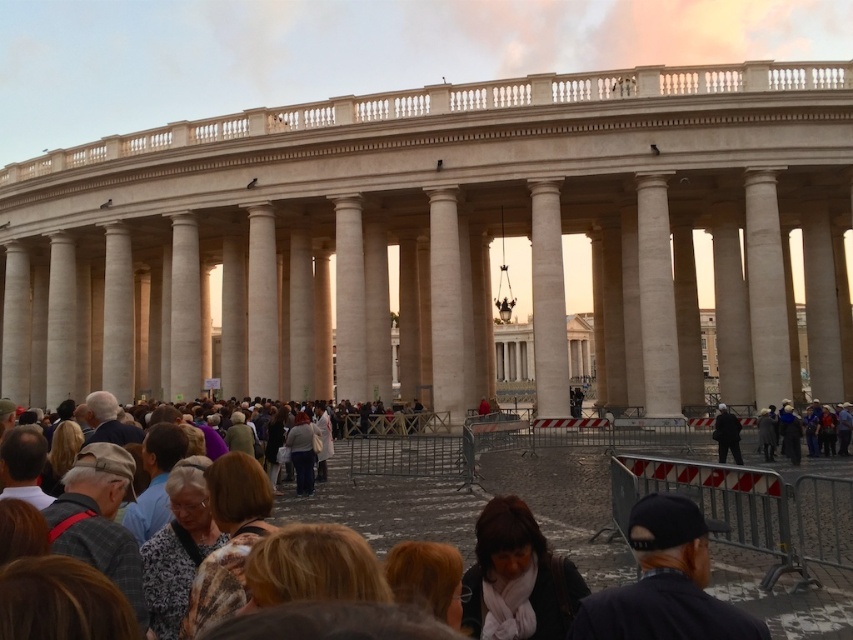
From the picture: You are standing in front of the grand classical building and want to take a photo of the white marble column at center and the light brown leather jacket at center. If your camera has a maximum focusing distance of 85 feet, will you be able to capture both objects clearly in the same photo?

The white marble column at center is 87.80 feet away from the light brown leather jacket at center. Since the camera can only focus up to 85 feet, the distance between them exceeds the camera range. Therefore, you cannot capture both objects clearly in the same photo.

You are standing in the crowd in front of the grand classical building. You notice two points marked in the scene. The first point is at coordinates point (491, 509), and the second is at point (308, 445). Which point is closer to you?

Point (491, 509) is in front of point (308, 445), so the first point is closer to you.